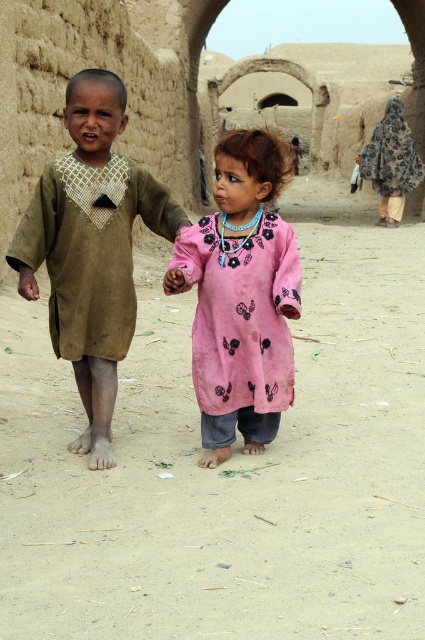
Does dusty brown ground at center appear over brown suede dress at center?

Incorrect, dusty brown ground at center is not positioned above brown suede dress at center.

Can you confirm if dusty brown ground at center is taller than brown suede dress at center?

Correct, dusty brown ground at center is much taller as brown suede dress at center.

Is point (147, 637) behind point (164, 214)?

No, it is in front of (164, 214).

At what (x,y) coordinates should I click in order to perform the action: click on dusty brown ground at center. Please return your answer as a coordinate pair (x, y). The height and width of the screenshot is (640, 425). Looking at the image, I should click on (229, 464).

Can you confirm if dusty brown ground at center is thinner than floral-patterned fabric at upper right?

No.

Based on the photo, is dusty brown ground at center shorter than floral-patterned fabric at upper right?

In fact, dusty brown ground at center may be taller than floral-patterned fabric at upper right.

Describe the element at coordinates (229, 464) in the screenshot. This screenshot has height=640, width=425. I see `dusty brown ground at center` at that location.

Where is `dusty brown ground at center`? The image size is (425, 640). dusty brown ground at center is located at coordinates (229, 464).

Is dusty brown ground at center positioned behind pink fabric dress at center?

No, dusty brown ground at center is closer to the viewer.

Does point (268, 634) lie in front of point (255, 316)?

Yes, point (268, 634) is closer to viewer.

Where is `dusty brown ground at center`? The image size is (425, 640). dusty brown ground at center is located at coordinates (229, 464).